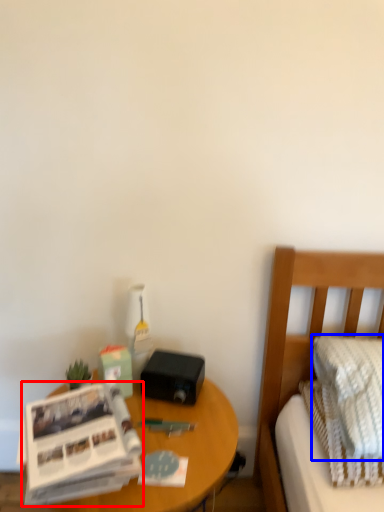
Question: Which of the following is the farthest to the observer, paperback book (highlighted by a red box) or pillow (highlighted by a blue box)?

Choices:
 (A) paperback book
 (B) pillow

Answer: (B)